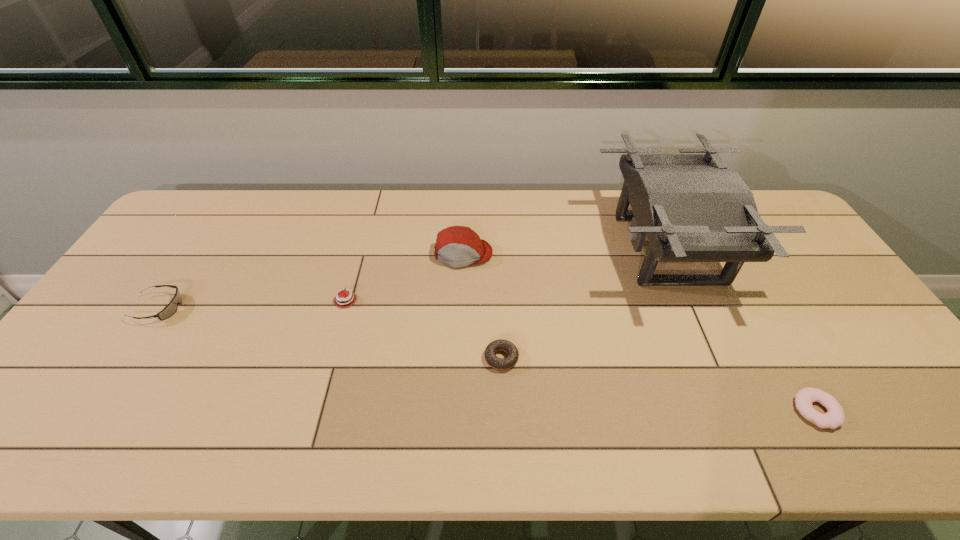
Where is `vacant space situated 0.390m with a camera mounted on the underside of the drone`? The height and width of the screenshot is (540, 960). vacant space situated 0.390m with a camera mounted on the underside of the drone is located at coordinates (474, 249).

Identify the location of vacant space located with a camera mounted on the underside of the drone. This screenshot has height=540, width=960. click(496, 249).

Locate an element on the screen. vacant region located on the front-facing side of the cap is located at coordinates (459, 363).

Where is `vacant point located 0.300m on the lenses of the third tallest object`? This screenshot has height=540, width=960. vacant point located 0.300m on the lenses of the third tallest object is located at coordinates click(x=289, y=308).

At what (x,y) coordinates should I click in order to perform the action: click on free space located 0.310m on the left of the chocolate cake. Please return your answer as a coordinate pair (x, y). The image size is (960, 540). Looking at the image, I should click on (208, 300).

Where is `vacant position located on the back of the fifth farthest object`? vacant position located on the back of the fifth farthest object is located at coordinates pos(500,317).

Find the location of a particular element. Image resolution: width=960 pixels, height=540 pixels. vacant position located 0.170m on the right of the right doughnut is located at coordinates (911, 410).

You are a GUI agent. You are given a task and a screenshot of the screen. Output one action in this format:
    pyautogui.click(x=<x>, y=<y>)
    Task: Click on the object at the far edge
    The width and height of the screenshot is (960, 540).
    Given the screenshot: What is the action you would take?
    pyautogui.click(x=692, y=208)

Image resolution: width=960 pixels, height=540 pixels. In order to click on object at the near edge in this screenshot , I will do `click(835, 417)`.

Locate an element on the screen. object that is at the left edge is located at coordinates (171, 308).